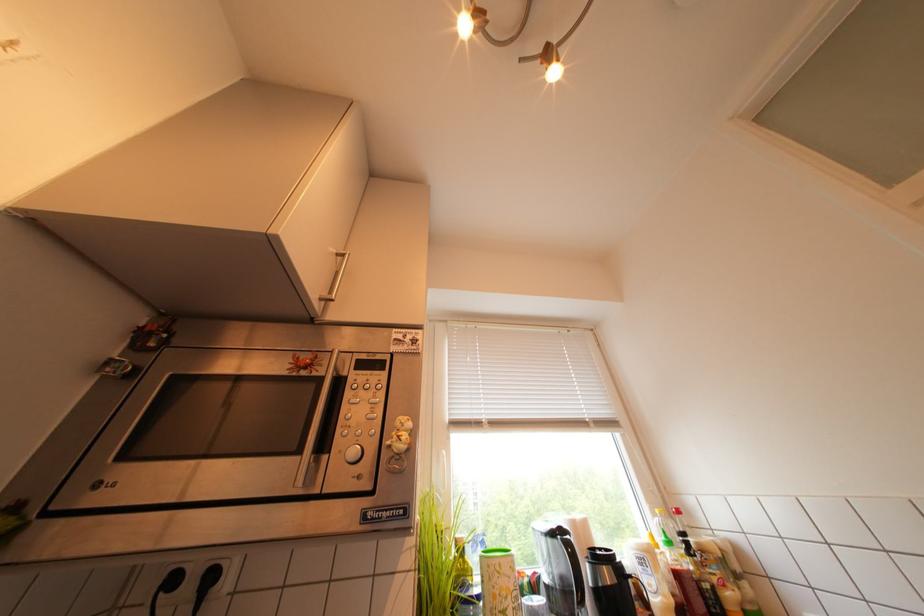
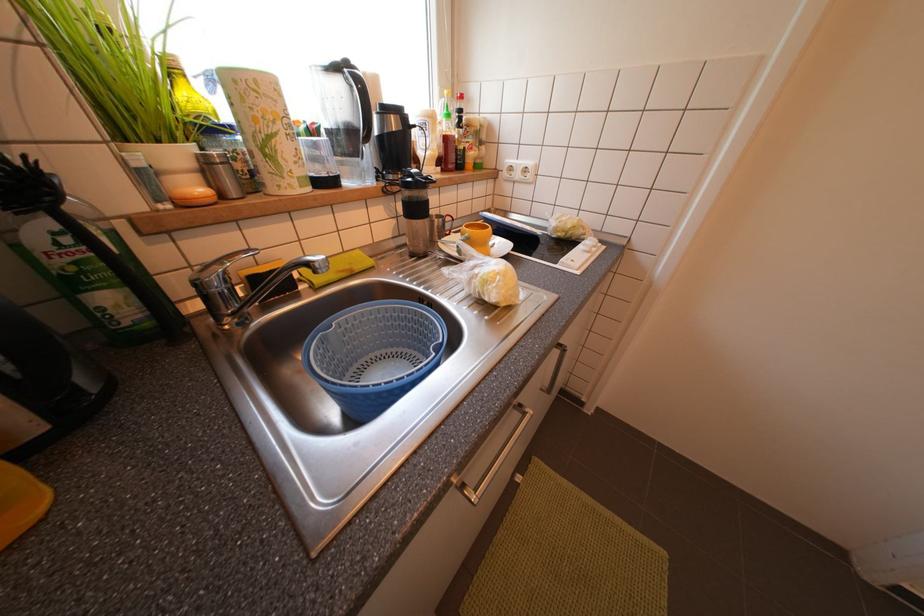
First-person continuous shooting, in which direction is the camera rotating?

The rotation direction of the camera is right-down.